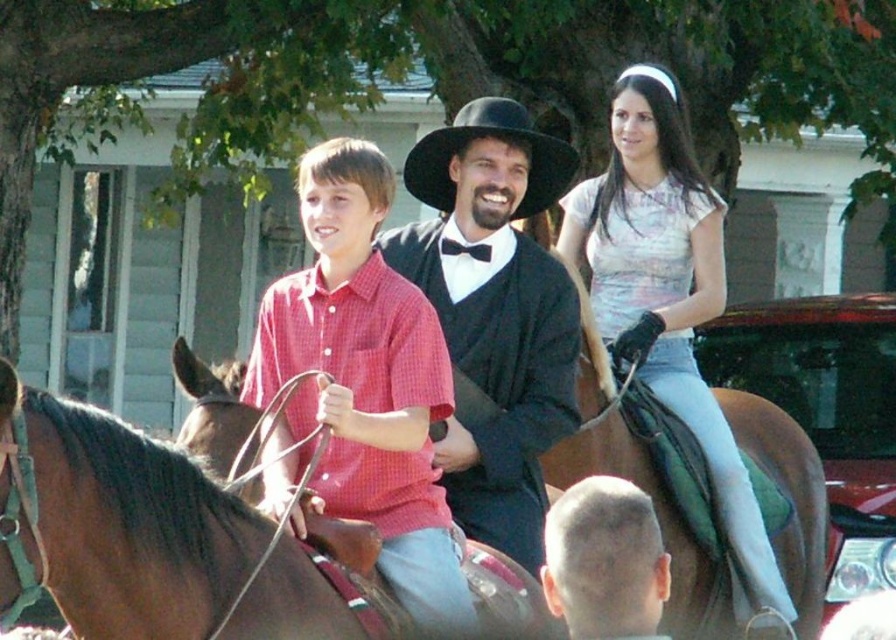
You are a photographer trying to capture a group photo of the two people in the middle ground. You need to arrange them so that the shaved head at center is positioned to the right of the black felt cowboy hat at center. Is this possible based on their current positions?

Yes, because the shaved head at center is already positioned to the right of the black felt cowboy hat at center according to the description.

You are a photographer trying to frame a shot that includes both the light pink sheer blouse at upper right and the shaved head at center. Which object should you adjust your camera to focus on first to ensure both fit in the frame?

The light pink sheer blouse at upper right is wider than the shaved head at center, so you should focus on the light pink sheer blouse at upper right first to accommodate its larger width in the frame.